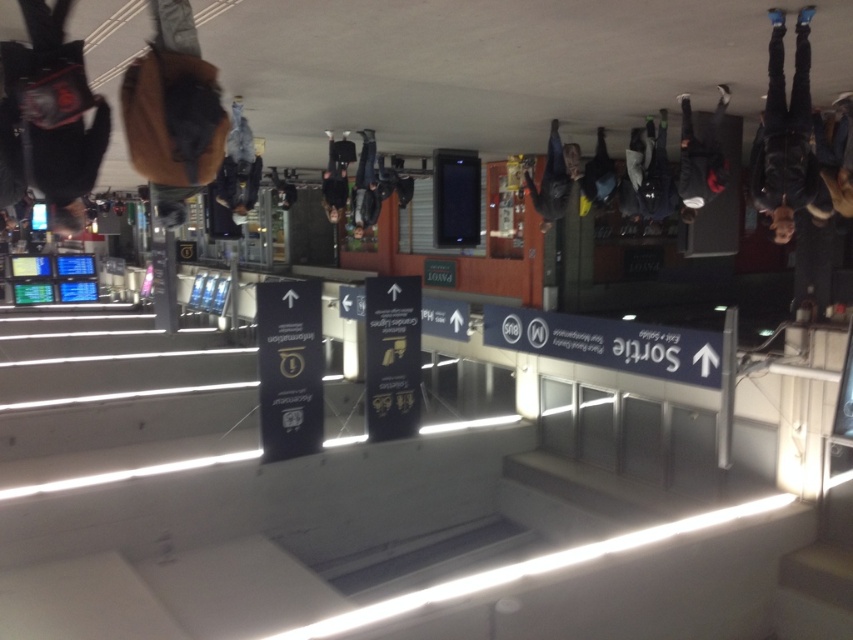
Question: From the image, what is the correct spatial relationship of matte brown backpack at upper left in relation to dark gray fabric bag at upper center?

Choices:
 (A) right
 (B) left

Answer: (B)

Question: Which object is positioned farthest from the dark gray backpack at upper right?

Choices:
 (A) brown fuzzy backpack at upper left
 (B) dark blue jeans at upper right
 (C) matte black bag at center
 (D) matte black backpack at center

Answer: (A)

Question: Is matte black backpack at center wider than dark blue jacket at center?

Choices:
 (A) yes
 (B) no

Answer: (A)

Question: Which point is closer to the camera?

Choices:
 (A) matte black backpack at center
 (B) dark blue jeans at upper right

Answer: (B)

Question: Where is matte brown backpack at upper left located in relation to black leather pants at upper right in the image?

Choices:
 (A) right
 (B) left

Answer: (B)

Question: Which of these objects is positioned farthest from the brown fuzzy backpack at upper left?

Choices:
 (A) dark gray backpack at upper right
 (B) matte black backpack at center
 (C) dark gray fabric bag at upper center

Answer: (B)